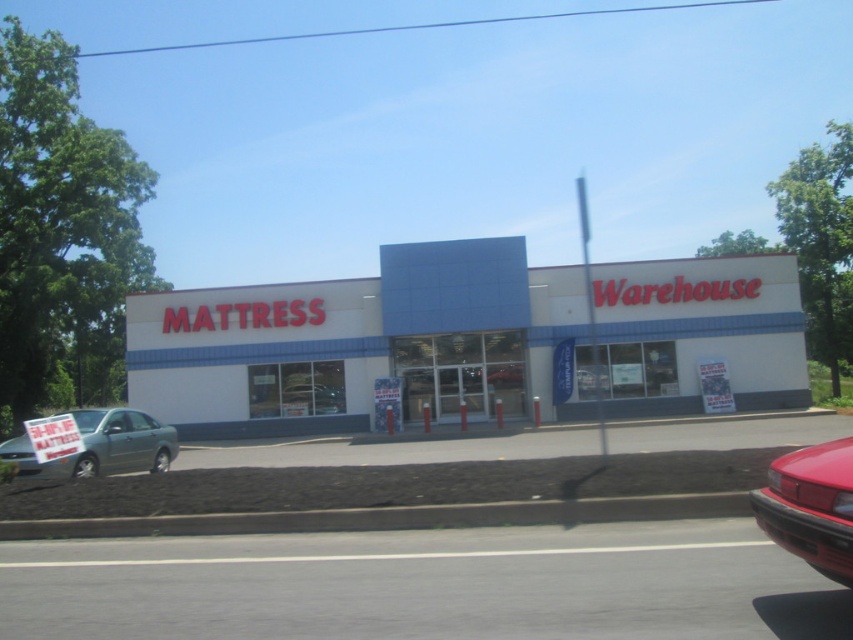
Question: Among these objects, which one is farthest from the camera?

Choices:
 (A) white matte building at center
 (B) matte black mattress sign at lower left

Answer: (A)

Question: Which of the following is the farthest from the observer?

Choices:
 (A) shiny red car at lower right
 (B) white matte building at center
 (C) matte black mattress sign at lower left
 (D) green matte sedan at lower left

Answer: (B)

Question: Is white matte building at center positioned before green matte sedan at lower left?

Choices:
 (A) no
 (B) yes

Answer: (A)

Question: Is white matte building at center above matte black mattress sign at lower left?

Choices:
 (A) yes
 (B) no

Answer: (A)

Question: Which point is closer to the camera?

Choices:
 (A) (840, 472)
 (B) (782, 298)

Answer: (A)

Question: Is white matte building at center positioned at the back of shiny red car at lower right?

Choices:
 (A) no
 (B) yes

Answer: (B)